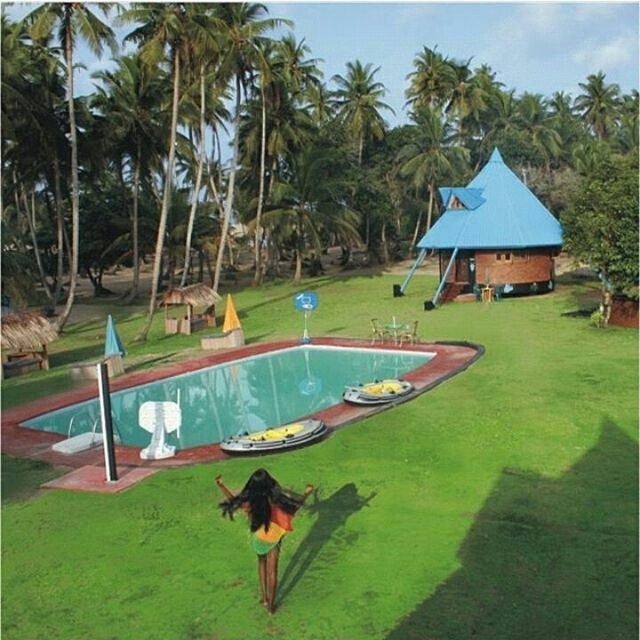
Question: Is the position of blue brick hut at upper right more distant than that of rainbow fabric dress at center?

Choices:
 (A) yes
 (B) no

Answer: (A)

Question: Does green grass at lower center appear on the right side of blue brick hut at upper right?

Choices:
 (A) no
 (B) yes

Answer: (A)

Question: Based on their relative distances, which object is farther from the green smooth swimming pool at center?

Choices:
 (A) rainbow fabric dress at center
 (B) green leafy palm tree at upper right
 (C) blue brick hut at upper right

Answer: (B)

Question: Which point is closer to the camera taking this photo?

Choices:
 (A) (272, 380)
 (B) (252, 515)
 (C) (534, 220)

Answer: (B)

Question: Does rainbow fabric dress at center lie behind green leafy palm tree at upper right?

Choices:
 (A) no
 (B) yes

Answer: (A)

Question: Which of these objects is positioned farthest from the rainbow fabric dress at center?

Choices:
 (A) green leafy palm tree at upper right
 (B) green smooth swimming pool at center
 (C) blue brick hut at upper right
 (D) green grass at lower center

Answer: (A)